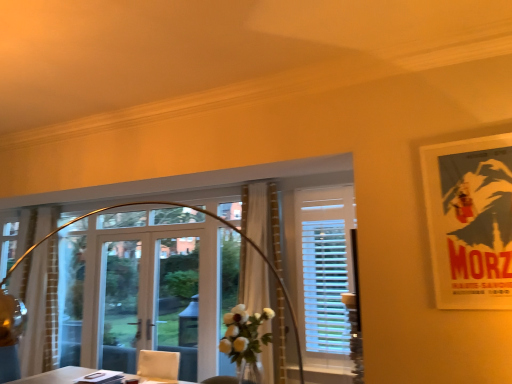
What do you see at coordinates (253, 279) in the screenshot?
I see `white sheer curtain at center, the second curtain in the left-to-right sequence` at bounding box center [253, 279].

In order to face white plastic blinds at center, which is the 2th window from left to right, should I rotate leftwards or rightwards?

To face it directly, rotate right by 9.329 degrees.

Measure the distance between transparent glass window at center, which is counted as the first window, starting from the left, and camera.

2.25 meters.

This screenshot has height=384, width=512. In order to click on clear glass door at center in this screenshot , I will do `click(150, 300)`.

Describe the element at coordinates (150, 300) in the screenshot. The image size is (512, 384). I see `clear glass door at center` at that location.

The image size is (512, 384). What do you see at coordinates (470, 221) in the screenshot? I see `matte paper poster at upper right` at bounding box center [470, 221].

Identify the location of white sheer curtain at center, which appears as the second curtain when viewed from the back. (253, 279).

Is matte paper poster at upper right closer to the viewer compared to white plastic blinds at center, the 1th window positioned from the back?

Yes, matte paper poster at upper right is closer to the viewer.

Is matte paper poster at upper right looking in the opposite direction of white plastic blinds at center, the 1th window positioned from the back?

No.

From the image's perspective, count 2nd windows downward from the matte paper poster at upper right and point to it. Please provide its 2D coordinates.

[(325, 272)]

Consider the image. From the image's perspective, is matte paper poster at upper right above or below white sheer curtain at center, the second curtain in the left-to-right sequence?

Clearly, from the image's perspective, matte paper poster at upper right is above white sheer curtain at center, the second curtain in the left-to-right sequence.

Is matte paper poster at upper right in front of or behind white sheer curtain at center, which appears as the second curtain when viewed from the back, in the image?

In the image, matte paper poster at upper right appears in front of white sheer curtain at center, which appears as the second curtain when viewed from the back.

Considering the sizes of matte paper poster at upper right and white sheer curtain at center, which appears as the second curtain when viewed from the back, in the image, is matte paper poster at upper right taller or shorter than white sheer curtain at center, which appears as the second curtain when viewed from the back,?

Considering their sizes, matte paper poster at upper right has less height than white sheer curtain at center, which appears as the second curtain when viewed from the back.

Choose the correct answer: Is matte paper poster at upper right inside white sheer curtain at center, acting as the 1th curtain starting from the front, or outside it?

matte paper poster at upper right is located beyond the bounds of white sheer curtain at center, acting as the 1th curtain starting from the front.

In the scene shown: From the image's perspective, which one is positioned higher, transparent glass window at center, the second window when ordered from back to front, or clear glass door at center?

transparent glass window at center, the second window when ordered from back to front.

Locate an element on the screen. the 1st window directly above the clear glass door at center (from a real-world perspective) is located at coordinates (200, 186).

Does transparent glass window at center, acting as the 2th window starting from the right, have a lesser width compared to clear glass door at center?

In fact, transparent glass window at center, acting as the 2th window starting from the right, might be wider than clear glass door at center.

Is transparent glass window at center, the second window when ordered from back to front, to the right of clear glass door at center from the viewer's perspective?

Yes.

Which of these two, matte paper poster at upper right or transparent glass window at center, the second window when ordered from back to front, is thinner?

With smaller width is matte paper poster at upper right.

Find the location of a particular element. Image resolution: width=512 pixels, height=384 pixels. the 2nd window counting from the left of the matte paper poster at upper right is located at coordinates (200, 186).

Which point is more distant from viewer, (470, 299) or (162, 185)?

The point (162, 185) is farther.

Is matte paper poster at upper right completely or partially outside of transparent glass window at center, which is counted as the first window, starting from the left?

That's correct, matte paper poster at upper right is outside of transparent glass window at center, which is counted as the first window, starting from the left.

Between white plastic blinds at center, placed as the 2th window when sorted from front to back, and white sheer curtain at center, acting as the 1th curtain starting from the front, which one has smaller size?

With smaller size is white plastic blinds at center, placed as the 2th window when sorted from front to back.

From a real-world perspective, is white plastic blinds at center, placed as the 2th window when sorted from front to back, beneath white sheer curtain at center, acting as the 1th curtain starting from the front?

No, from a real-world perspective, white plastic blinds at center, placed as the 2th window when sorted from front to back, is not beneath white sheer curtain at center, acting as the 1th curtain starting from the front.

Considering the sizes of objects white plastic blinds at center, which is the 2th window from left to right, and white sheer curtain at center, the second curtain in the left-to-right sequence, in the image provided, who is shorter, white plastic blinds at center, which is the 2th window from left to right, or white sheer curtain at center, the second curtain in the left-to-right sequence,?

white plastic blinds at center, which is the 2th window from left to right.

There is a white plastic blinds at center, positioned as the first window in right-to-left order. Where is `the 1st curtain below it (from the image's perspective)`? The image size is (512, 384). the 1st curtain below it (from the image's perspective) is located at coordinates (253, 279).

Is transparent glass window at center, the second window when ordered from back to front, not near white sheer curtain at center, acting as the 1th curtain starting from the front?

No.

Which is behind, point (54, 196) or point (256, 370)?

Positioned behind is point (54, 196).

Which is more to the right, transparent glass window at center, the second window when ordered from back to front, or white sheer curtain at center, the second curtain in the left-to-right sequence?

white sheer curtain at center, the second curtain in the left-to-right sequence, is more to the right.

From a real-world perspective, is transparent glass window at center, which is counted as the first window, starting from the left, positioned above or below white sheer curtain at left, the 1th curtain positioned from the left?

Clearly, from a real-world perspective, transparent glass window at center, which is counted as the first window, starting from the left, is above white sheer curtain at left, the 1th curtain positioned from the left.

Is transparent glass window at center, acting as the 2th window starting from the right, not close to white sheer curtain at left, positioned as the 1th curtain in back-to-front order?

Yes.

Is transparent glass window at center, which is counted as the first window, starting from the left, aimed at white sheer curtain at left, arranged as the 2th curtain when viewed from the front?

No.

Who is smaller, transparent glass window at center, which is counted as the first window, starting from the left, or white sheer curtain at left, the 1th curtain positioned from the left?

white sheer curtain at left, the 1th curtain positioned from the left.

Locate an element on the screen. The width and height of the screenshot is (512, 384). window that is the 1st one when counting leftward from the matte paper poster at upper right is located at coordinates (325, 272).

This screenshot has width=512, height=384. In the image, there is a white sheer curtain at center, the 1th curtain positioned from the right. Find the location of `poster page above it (from the image's perspective)`. poster page above it (from the image's perspective) is located at coordinates (470, 221).

Looking at this image, estimate the real-world distances between objects in this image. Which object is further from transparent glass window at center, acting as the 2th window starting from the right, clear glass door at center or white sheer curtain at center, the 1th curtain positioned from the right?

The object further to transparent glass window at center, acting as the 2th window starting from the right, is clear glass door at center.

Which object lies nearer to the anchor point matte paper poster at upper right, white sheer curtain at left, the second curtain positioned from the right, or transparent glass window at center, acting as the 2th window starting from the right?

transparent glass window at center, acting as the 2th window starting from the right, is closer to matte paper poster at upper right.

Considering their positions, is white plastic blinds at center, which is the 2th window from left to right, positioned closer to clear glass door at center than transparent glass window at center, the 1th window when ordered from front to back?

The object closer to clear glass door at center is transparent glass window at center, the 1th window when ordered from front to back.

Based on their spatial positions, is clear glass door at center or transparent glass window at center, the second window when ordered from back to front, closer to white sheer curtain at center, which appears as the second curtain when viewed from the back?

transparent glass window at center, the second window when ordered from back to front.

Estimate the real-world distances between objects in this image. Which object is closer to matte paper poster at upper right, white plastic blinds at center, positioned as the first window in right-to-left order, or white sheer curtain at left, the 1th curtain positioned from the left?

The object closer to matte paper poster at upper right is white plastic blinds at center, positioned as the first window in right-to-left order.

Looking at the image, which one is located further to matte paper poster at upper right, clear glass door at center or white plastic blinds at center, which is the 2th window from left to right?

clear glass door at center is positioned further to the anchor matte paper poster at upper right.

Considering their positions, is white sheer curtain at left, arranged as the 2th curtain when viewed from the front, positioned closer to white sheer curtain at center, the 1th curtain positioned from the right, than clear glass door at center?

clear glass door at center is positioned closer to the anchor white sheer curtain at center, the 1th curtain positioned from the right.

Which object lies further to the anchor point white sheer curtain at left, the 1th curtain positioned from the left, clear glass door at center or matte paper poster at upper right?

The object further to white sheer curtain at left, the 1th curtain positioned from the left, is matte paper poster at upper right.

Where is `curtain positioned between matte paper poster at upper right and clear glass door at center from near to far`? The height and width of the screenshot is (384, 512). curtain positioned between matte paper poster at upper right and clear glass door at center from near to far is located at coordinates (253, 279).

Locate an element on the screen. screen door between white sheer curtain at left, arranged as the 2th curtain when viewed from the front, and white plastic blinds at center, which is the 2th window from left to right is located at coordinates (150, 300).

Locate an element on the screen. window located between white sheer curtain at left, positioned as the 1th curtain in back-to-front order, and white plastic blinds at center, which is the 2th window from left to right, in the left-right direction is located at coordinates (200, 186).

Find the location of `curtain between transparent glass window at center, the second window when ordered from back to front, and white sheer curtain at left, positioned as the 1th curtain in back-to-front order, along the z-axis`. curtain between transparent glass window at center, the second window when ordered from back to front, and white sheer curtain at left, positioned as the 1th curtain in back-to-front order, along the z-axis is located at coordinates (253, 279).